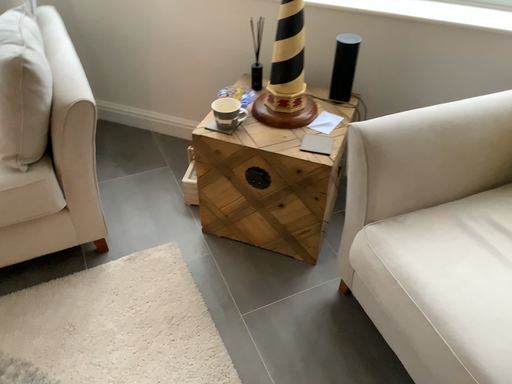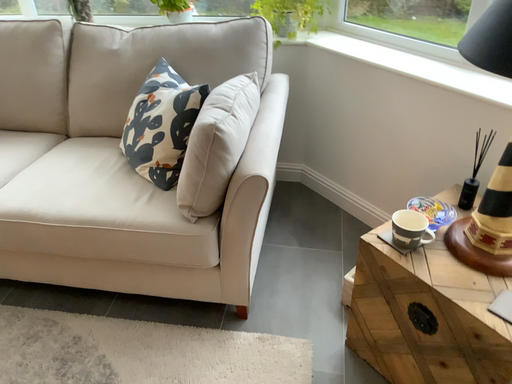
Question: How did the camera likely rotate when shooting the video?

Choices:
 (A) rotated downward
 (B) rotated upward

Answer: (B)